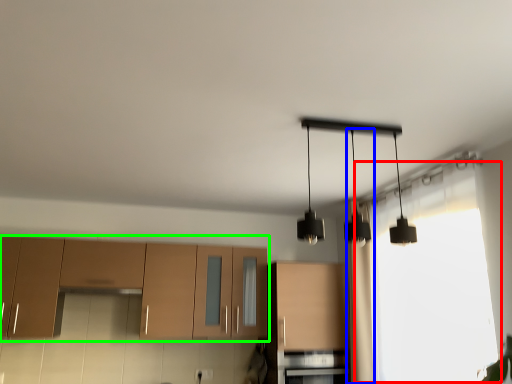
Question: Which object is positioned closest to window (highlighted by a red box)? Select from curtain (highlighted by a blue box) and cabinetry (highlighted by a green box).

Choices:
 (A) curtain
 (B) cabinetry

Answer: (A)